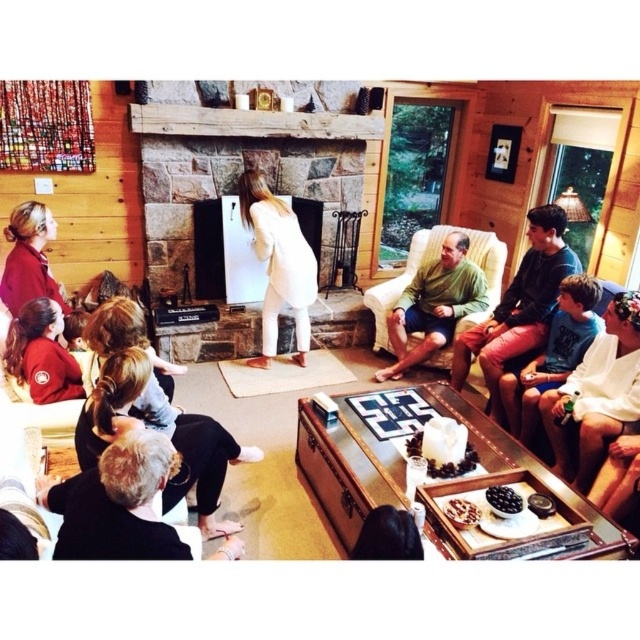
Can you confirm if matte red jacket at center is taller than matte red jacket at lower left?

Yes.

You are a GUI agent. You are given a task and a screenshot of the screen. Output one action in this format:
    pyautogui.click(x=<x>, y=<y>)
    Task: Click on the matte red jacket at center
    The width and height of the screenshot is (640, 640).
    Given the screenshot: What is the action you would take?
    (29, 268)

In order to click on matte red jacket at center in this screenshot , I will do `click(29, 268)`.

In the scene shown: Is green fabric armchair at center wider than white cotton shirt at lower right?

Yes, green fabric armchair at center is wider than white cotton shirt at lower right.

At what (x,y) coordinates should I click in order to perform the action: click on green fabric armchair at center. Please return your answer as a coordinate pair (x, y). The width and height of the screenshot is (640, 640). Looking at the image, I should click on (435, 296).

Between green fabric armchair at center and green cotton shirt at center, which one is positioned higher?

green fabric armchair at center is higher up.

Identify the location of green fabric armchair at center. (435, 296).

Is point (376, 324) closer to camera compared to point (560, 280)?

That is False.

Locate an element on the screen. Image resolution: width=640 pixels, height=640 pixels. green fabric armchair at center is located at coordinates (435, 296).